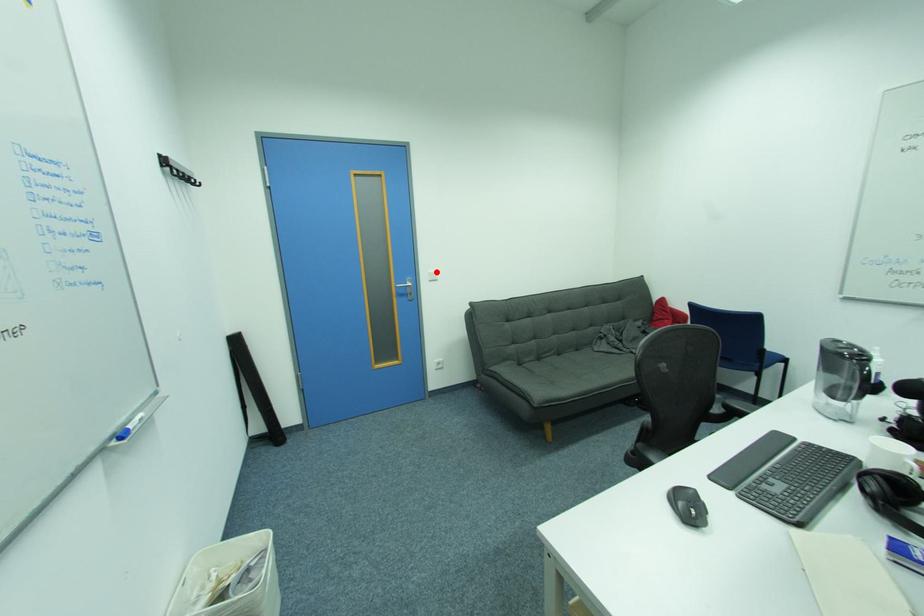
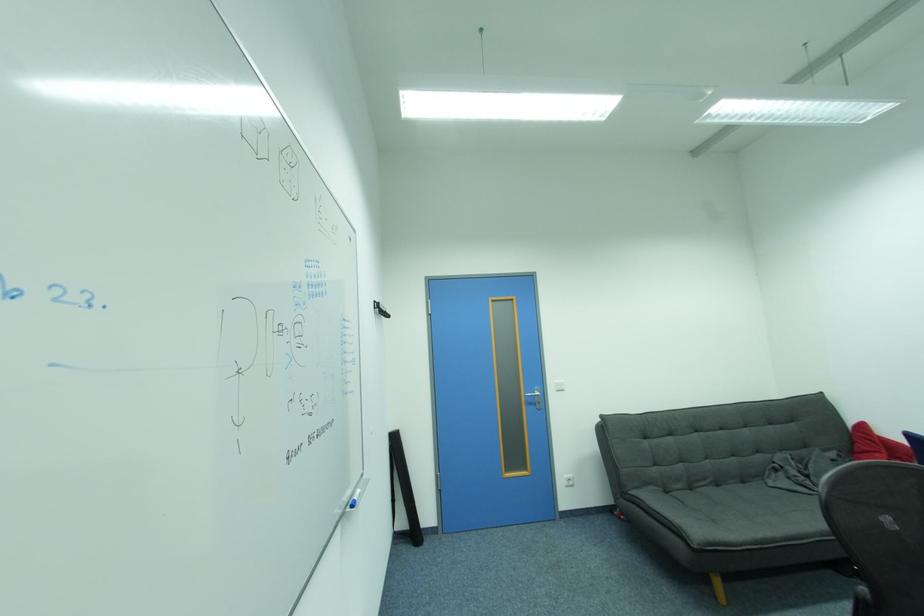
Question: I am providing you with two images of the same scene from different viewpoints. A red point is marked on the first image. Is the red point's position out of view in image 2?

Choices:
 (A) Yes
 (B) No

Answer: (B)